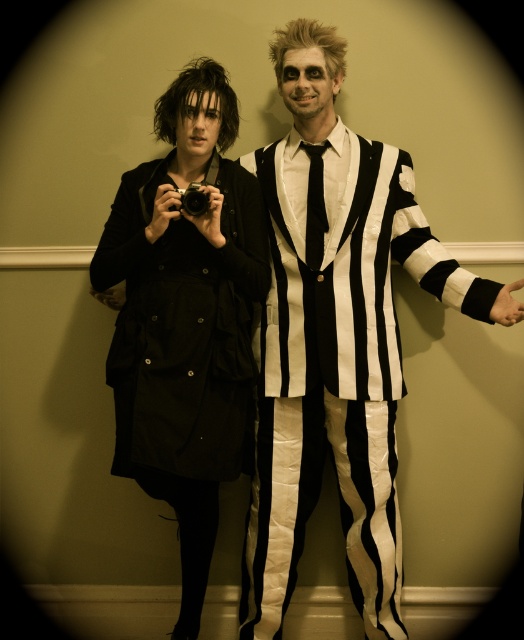
Find the location of a particular element. The image size is (524, 640). black matte coat at left is located at coordinates (184, 317).

Which is below, black matte coat at left or black plastic camera at center?

black matte coat at left

Who is more distant from viewer, [212,516] or [208,205]?

The point [212,516] is more distant.

Find the location of a particular element. black matte coat at left is located at coordinates (184, 317).